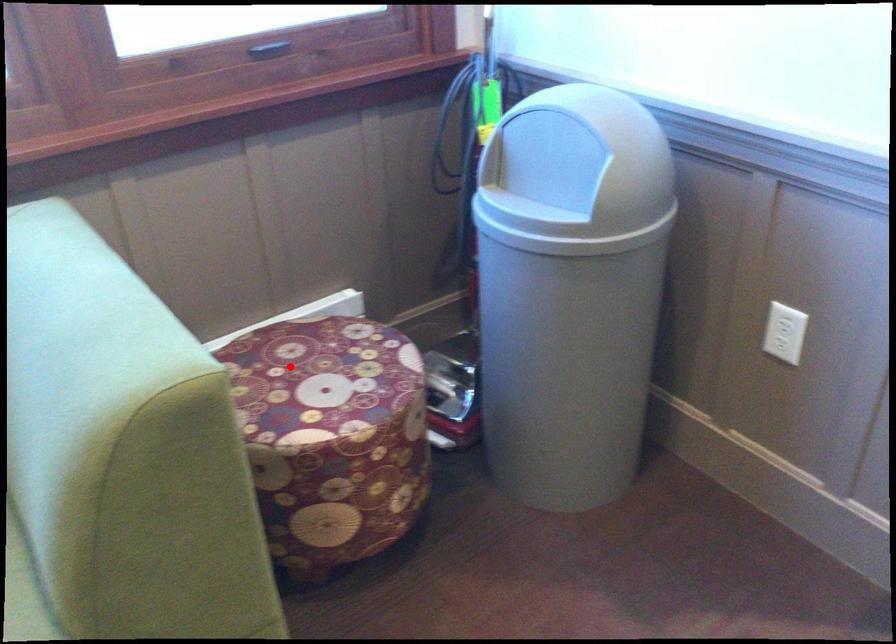
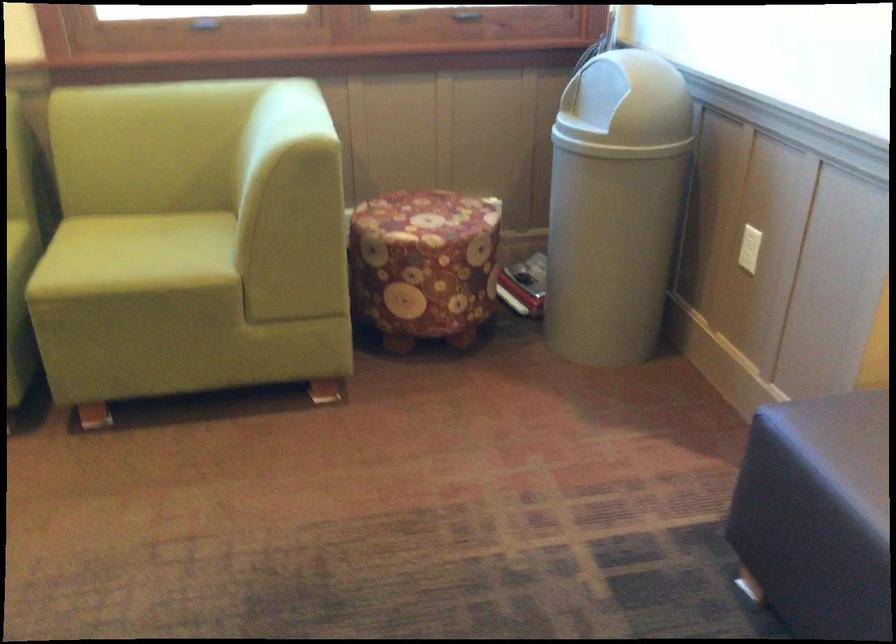
In the second image, find the point that corresponds to the highlighted location in the first image.

(414, 207)